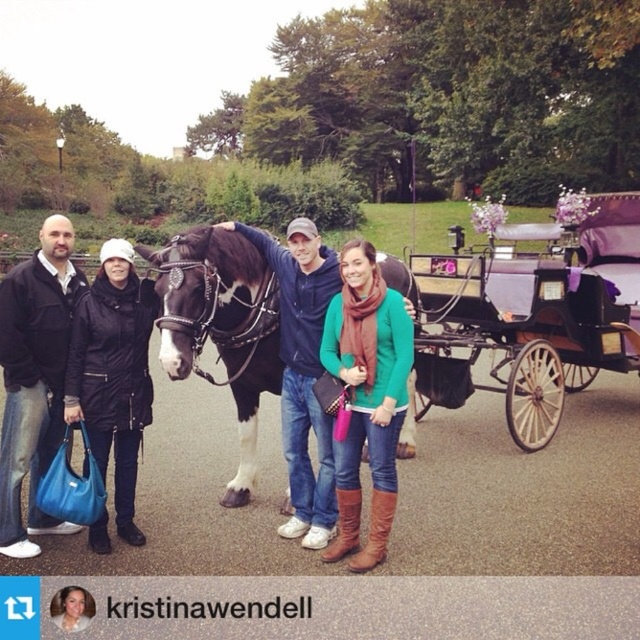
You are a photographer trying to capture a clear shot of the black glossy horse at center and the purple satin horse cart at right. However, you notice that one of these objects is blocking the other. Which object is being blocked and by which one?

The purple satin horse cart at right is positioned over black glossy horse at center, so the black glossy horse at center is being blocked by the purple satin horse cart at right.

You are standing at the center of the image and want to locate the purple satin horse cart at right. In which direction should you look to find it?

The purple satin horse cart at right is located at point 0.475 on the x axis and 0.844 on the y axis. Since you are at the center, you should look to the right and slightly downward to find it.

You are trying to decide which item to take with you from the scene. Both the matte black jacket at left and the black leather coat at left are available. If you prefer a more compact option, which one should you choose?

The matte black jacket at left has a smaller width than the black leather coat at left, so it is more compact and easier to carry.